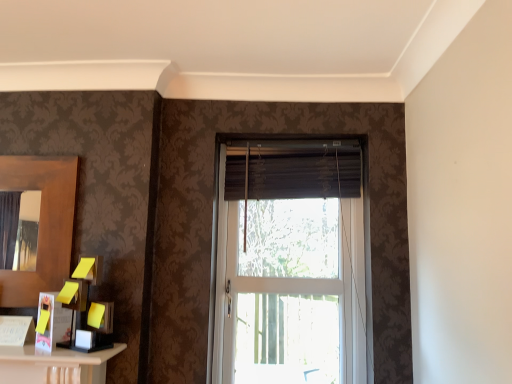
Question: Is white glass window at center further to the viewer compared to dark brown fabric curtain at center?

Choices:
 (A) no
 (B) yes

Answer: (A)

Question: Could you tell me if white glass window at center is facing dark brown fabric curtain at center?

Choices:
 (A) no
 (B) yes

Answer: (B)

Question: Is white glass window at center to the left of dark brown fabric curtain at center from the viewer's perspective?

Choices:
 (A) no
 (B) yes

Answer: (A)

Question: Is white glass window at center positioned with its back to dark brown fabric curtain at center?

Choices:
 (A) yes
 (B) no

Answer: (A)

Question: From a real-world perspective, is white glass window at center located beneath dark brown fabric curtain at center?

Choices:
 (A) yes
 (B) no

Answer: (A)

Question: Can you confirm if white glass window at center is smaller than dark brown fabric curtain at center?

Choices:
 (A) no
 (B) yes

Answer: (A)

Question: Does white glass window at center have a greater width compared to brown wooden mirror at left?

Choices:
 (A) yes
 (B) no

Answer: (A)

Question: Can you confirm if white glass window at center is positioned to the left of brown wooden mirror at left?

Choices:
 (A) no
 (B) yes

Answer: (A)

Question: Would you say white glass window at center is a long distance from brown wooden mirror at left?

Choices:
 (A) no
 (B) yes

Answer: (A)

Question: Is white glass window at center to the right of brown wooden mirror at left from the viewer's perspective?

Choices:
 (A) no
 (B) yes

Answer: (B)

Question: Is white glass window at center turned away from brown wooden mirror at left?

Choices:
 (A) yes
 (B) no

Answer: (B)

Question: Can you confirm if white glass window at center is taller than brown wooden mirror at left?

Choices:
 (A) no
 (B) yes

Answer: (B)

Question: Is brown wooden mirror at left smaller than dark brown fabric curtain at center?

Choices:
 (A) no
 (B) yes

Answer: (B)